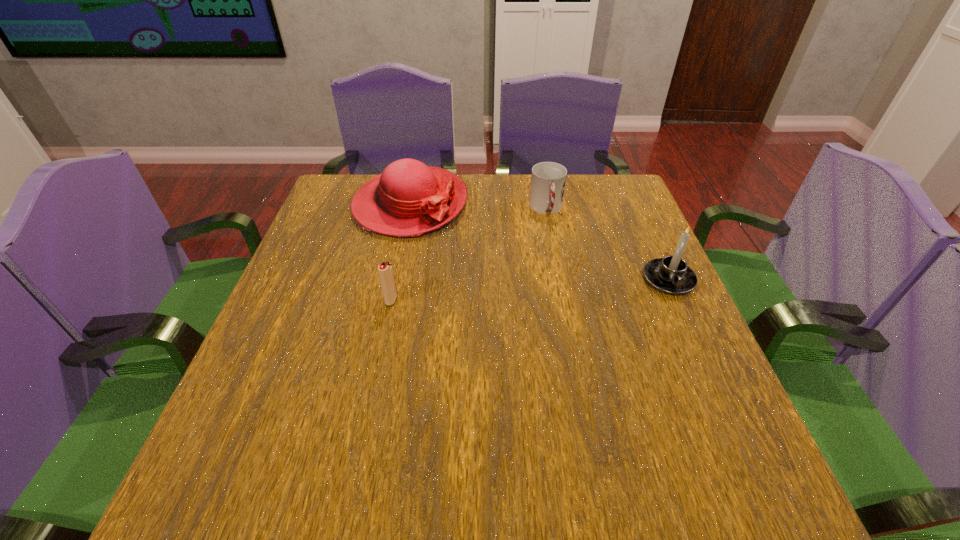
In the image, there is a desktop. Find the location of `free space at the left edge`. free space at the left edge is located at coordinates (329, 320).

At what (x,y) coordinates should I click in order to perform the action: click on free space at the right edge of the desktop. Please return your answer as a coordinate pair (x, y). The image size is (960, 540). Looking at the image, I should click on (631, 323).

Locate an element on the screen. The height and width of the screenshot is (540, 960). free space at the far right corner is located at coordinates (616, 192).

In the image, there is a desktop. Identify the location of free space at the near right corner. The height and width of the screenshot is (540, 960). (732, 411).

This screenshot has height=540, width=960. I want to click on free space between the cup and the third shortest object, so click(x=478, y=207).

The height and width of the screenshot is (540, 960). I want to click on free point between the third shortest object and the candle holder, so click(540, 242).

Find the location of a particular element. The height and width of the screenshot is (540, 960). blank region between the third shortest object and the candle holder is located at coordinates (540, 242).

The height and width of the screenshot is (540, 960). In order to click on free spot between the candle holder and the igniter in this screenshot , I will do `click(530, 290)`.

Find the location of `vacant area that lies between the cup and the hat`. vacant area that lies between the cup and the hat is located at coordinates (478, 207).

In order to click on vacant space that is in between the tallest object and the hat in this screenshot , I will do pos(540,242).